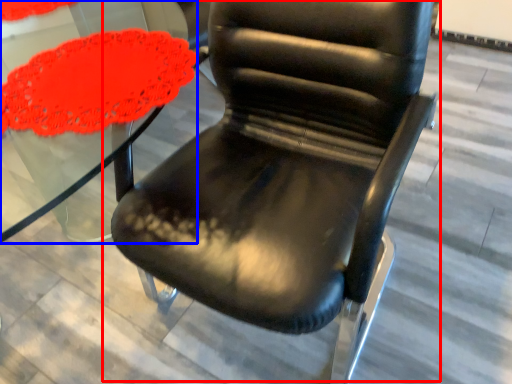
Question: Which object is closer to the camera taking this photo, chair (highlighted by a red box) or round table (highlighted by a blue box)?

Choices:
 (A) chair
 (B) round table

Answer: (A)